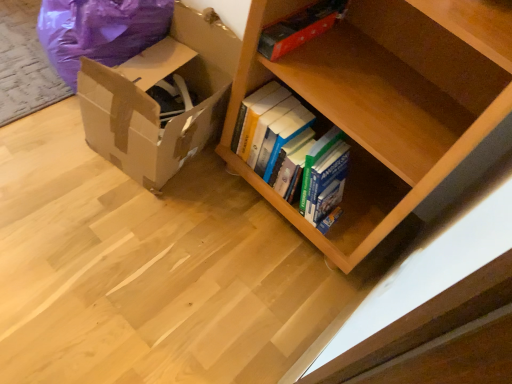
Question: Is hardcover books at center located within purple plastic bean bag chair at left?

Choices:
 (A) yes
 (B) no

Answer: (B)

Question: From the image's perspective, does purple plastic bean bag chair at left appear lower than hardcover books at center?

Choices:
 (A) no
 (B) yes

Answer: (A)

Question: From a real-world perspective, is purple plastic bean bag chair at left over hardcover books at center?

Choices:
 (A) yes
 (B) no

Answer: (A)

Question: Is purple plastic bean bag chair at left outside hardcover books at center?

Choices:
 (A) no
 (B) yes

Answer: (B)

Question: Could you tell me if purple plastic bean bag chair at left is facing hardcover books at center?

Choices:
 (A) no
 (B) yes

Answer: (A)

Question: Does purple plastic bean bag chair at left have a lesser width compared to hardcover books at center?

Choices:
 (A) yes
 (B) no

Answer: (B)

Question: Is brown cardboard box at lower left at the right side of hardcover books at center?

Choices:
 (A) yes
 (B) no

Answer: (B)

Question: Does brown cardboard box at lower left appear on the left side of hardcover books at center?

Choices:
 (A) no
 (B) yes

Answer: (B)

Question: Considering the relative sizes of brown cardboard box at lower left and hardcover books at center in the image provided, is brown cardboard box at lower left smaller than hardcover books at center?

Choices:
 (A) yes
 (B) no

Answer: (B)

Question: Does brown cardboard box at lower left come behind hardcover books at center?

Choices:
 (A) yes
 (B) no

Answer: (B)

Question: From the image's perspective, is brown cardboard box at lower left located beneath hardcover books at center?

Choices:
 (A) yes
 (B) no

Answer: (B)

Question: Is brown cardboard box at lower left far away from hardcover books at center?

Choices:
 (A) yes
 (B) no

Answer: (B)

Question: Considering the relative sizes of red matte book at upper center and purple plastic bean bag chair at left in the image provided, is red matte book at upper center wider than purple plastic bean bag chair at left?

Choices:
 (A) yes
 (B) no

Answer: (B)